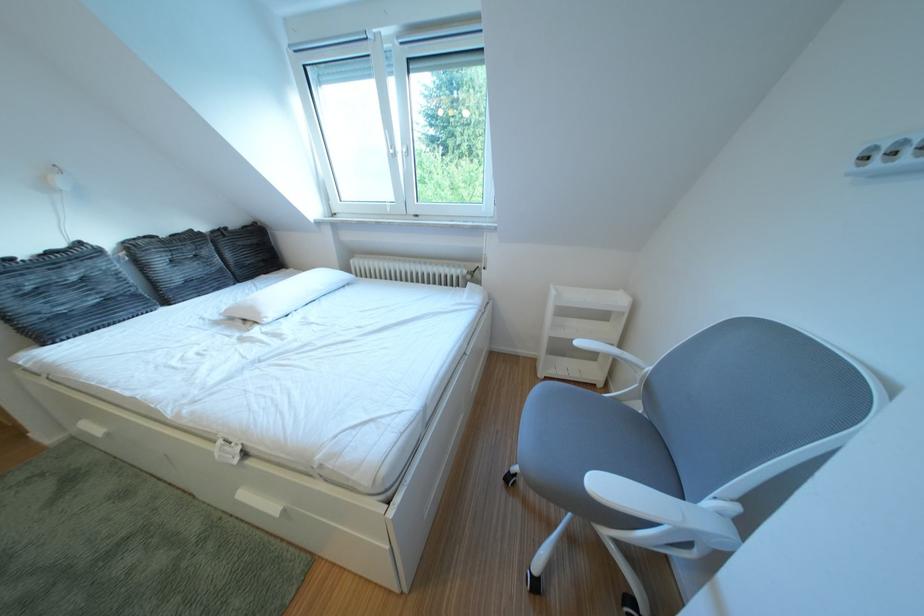
This screenshot has height=616, width=924. What do you see at coordinates (475, 267) in the screenshot?
I see `the radiator knob` at bounding box center [475, 267].